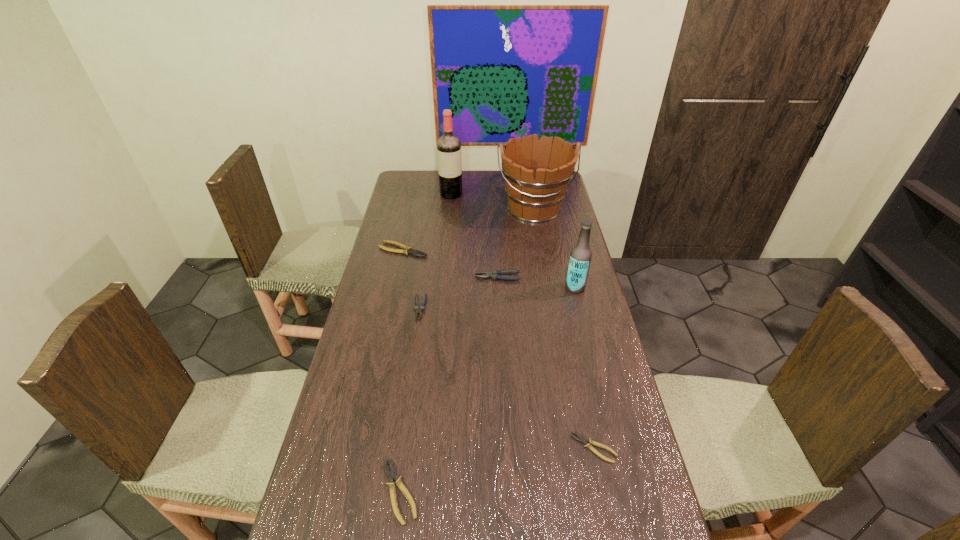
Find the location of a particular element. empty space between the seventh tallest object and the wine bucket is located at coordinates (467, 350).

Identify the location of unoccupied position between the shortest pliers and the liquor. The height and width of the screenshot is (540, 960). (522, 321).

The height and width of the screenshot is (540, 960). What are the coordinates of `free space that is in between the seventh nearest object and the fourth tallest object` in the screenshot? It's located at pos(450,264).

You are a GUI agent. You are given a task and a screenshot of the screen. Output one action in this format:
    pyautogui.click(x=<x>, y=<y>)
    Task: Click on the free space between the tallest object and the fourth nearest object
    This screenshot has width=960, height=540.
    Given the screenshot: What is the action you would take?
    pyautogui.click(x=436, y=251)

Select which object appears as the seventh closest to the smallest yellow pliers. Please provide its 2D coordinates. Your answer should be formatted as a tuple, i.e. [(x, y)], where the tuple contains the x and y coordinates of a point satisfying the conditions above.

[(537, 173)]

This screenshot has width=960, height=540. In order to click on the eighth closest object to the liquor in this screenshot , I will do `click(581, 539)`.

Identify which pliers is located as the fourth nearest to the beer bottle. Please provide its 2D coordinates. Your answer should be formatted as a tuple, i.e. [(x, y)], where the tuple contains the x and y coordinates of a point satisfying the conditions above.

[(588, 443)]

Select which pliers is the fourth closest to the wine bucket. Please provide its 2D coordinates. Your answer should be formatted as a tuple, i.e. [(x, y)], where the tuple contains the x and y coordinates of a point satisfying the conditions above.

[(588, 443)]

Point out which yellow pliers is positioned as the third nearest to the smaller gray pliers. Please provide its 2D coordinates. Your answer should be formatted as a tuple, i.e. [(x, y)], where the tuple contains the x and y coordinates of a point satisfying the conditions above.

[(588, 443)]

Identify the location of yellow pliers that is the closest one to the fourth pliers from left to right. (406, 250).